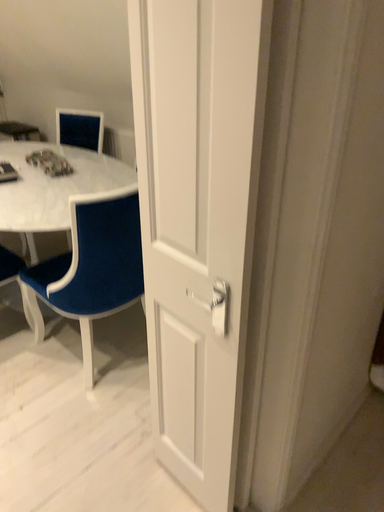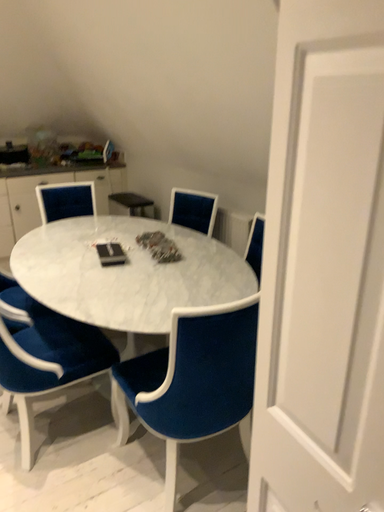
Question: Which way did the camera rotate in the video?

Choices:
 (A) rotated right
 (B) rotated left

Answer: (B)